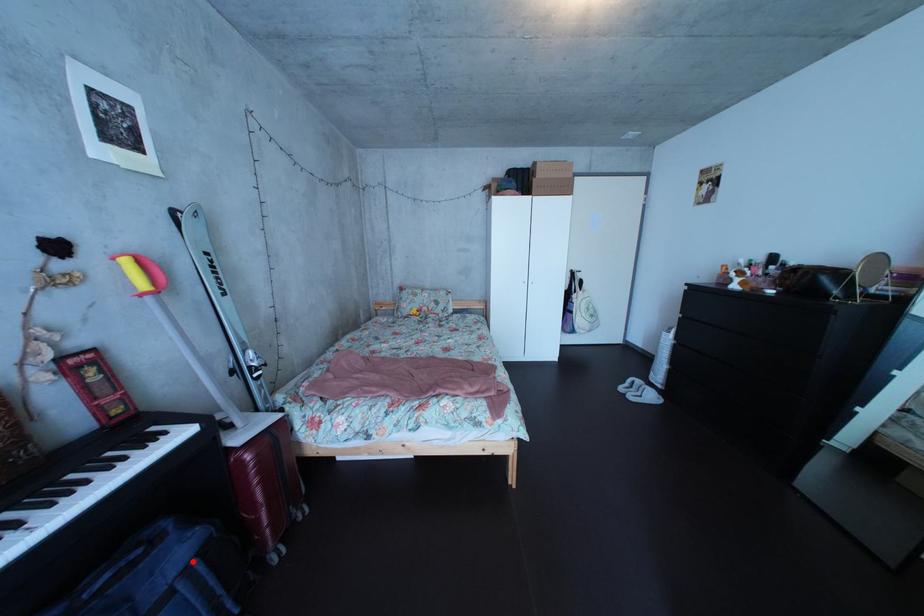
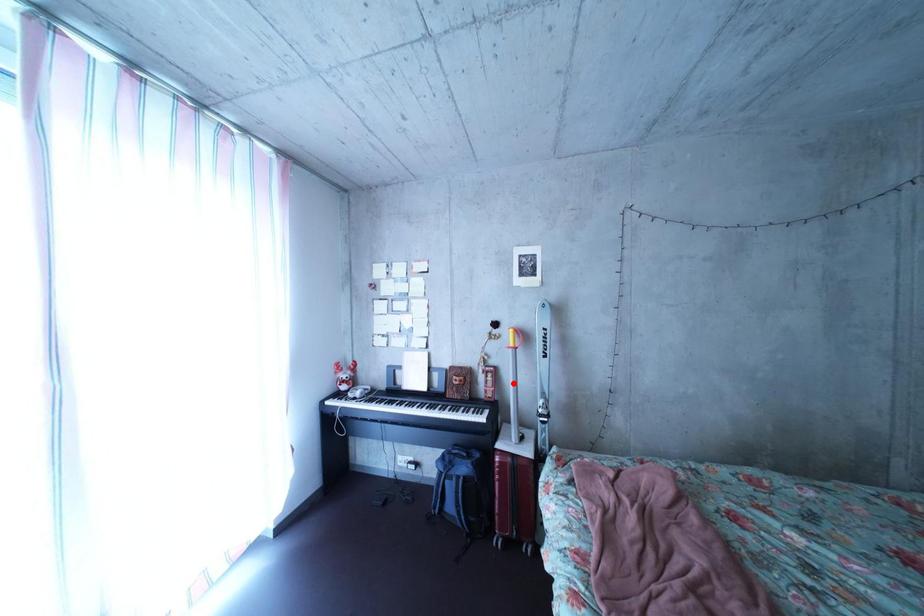
I am providing you with two images of the same scene from different viewpoints. A red point is marked on the first image and another point is marked on the second image. Is the red point in image1 aligned with the point shown in image2?

No